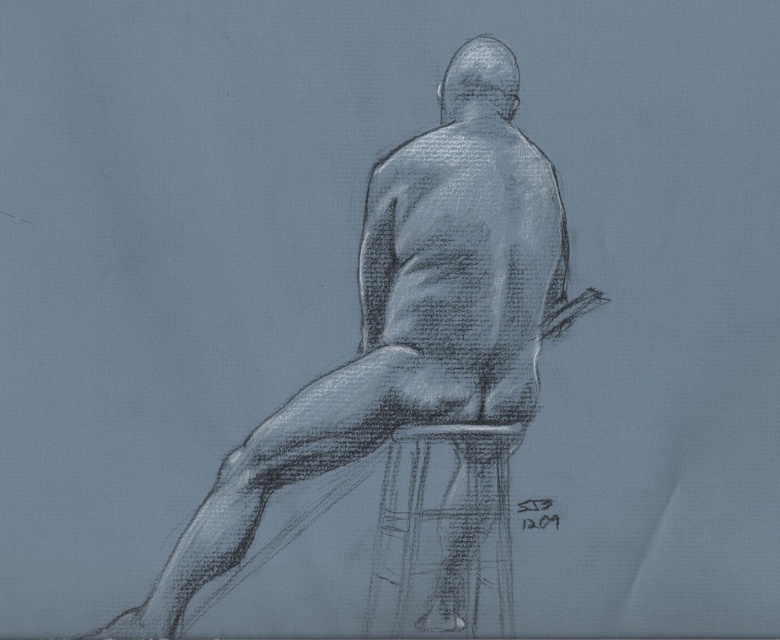
You are an art student analyzing a sketch. You observe the charcoal figure at center and the charcoal textured stool at center. Which object occupies more space in the drawing?

The charcoal figure at center is bigger than the charcoal textured stool at center, so it occupies more space in the drawing.

You are an art student analyzing the pencil sketch. You notice two charcoal objects at the center of the image. Which one is taller between the charcoal figure at center and the charcoal textured stool at center?

The charcoal figure at center is taller than the charcoal textured stool at center.

Based on the coordinates provided in the description, where is the charcoal figure at center positioned in the image?

The charcoal figure at center is precisely located at the coordinates point (410, 346).